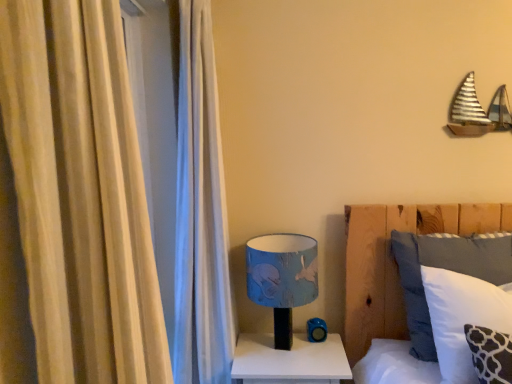
Question: Which is correct: white soft pillow at center is inside blue fabric lampshade at center, or outside of it?

Choices:
 (A) inside
 (B) outside

Answer: (B)

Question: From their relative heights in the image, would you say white soft pillow at center is taller or shorter than blue fabric lampshade at center?

Choices:
 (A) tall
 (B) short

Answer: (A)

Question: Considering the real-world distances, which object is closest to the white soft pillow at lower right?

Choices:
 (A) white soft pillow at center
 (B) white glossy nightstand at lower center
 (C) beige fabric curtain at left
 (D) blue fabric lampshade at center

Answer: (A)

Question: Which of these objects is positioned farthest from the white soft pillow at center?

Choices:
 (A) beige fabric curtain at left
 (B) white glossy nightstand at lower center
 (C) blue fabric lampshade at center
 (D) white soft pillow at lower right

Answer: (A)